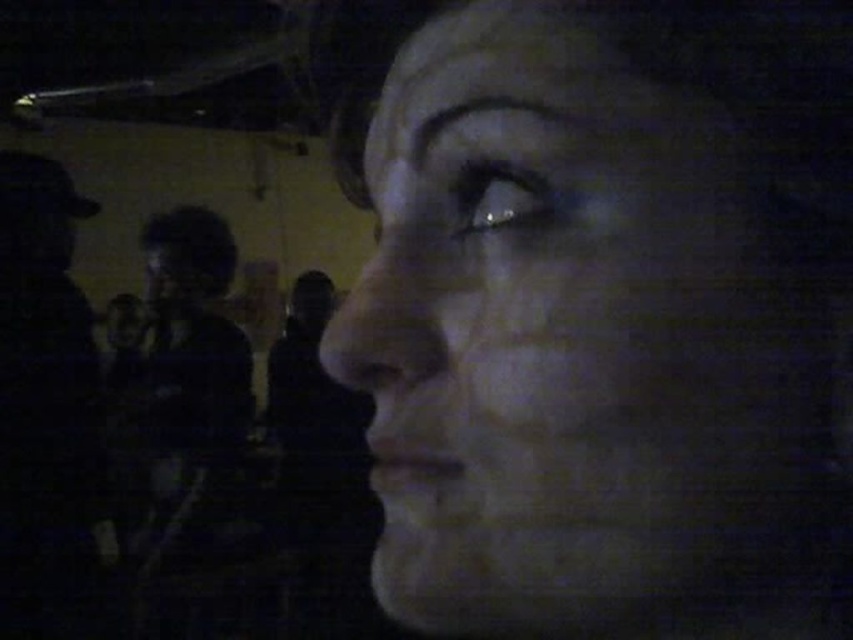
You are holding a camera and want to focus on a specific point in the image. The point you want to focus on is located at coordinates point (595, 582). Given that the distance from the camera to this point is 9.54 inches, can you confirm if this point is within the typical focusing range of a standard camera lens?

The distance of point (595, 582) from the camera is 9.54 inches. Standard camera lenses typically have a minimum focusing distance of around 8 inches, so this point is within the typical focusing range.

You are a photographer trying to position a spotlight for a photo shoot. You need to place the spotlight so that it illuminates the dark matte jacket at left without affecting the rest of the scene. Given the jacket is located at coordinates point 0.641, 0.054, where should you aim the spotlight?

The dark matte jacket at left is located at point (45, 410), so you should aim the spotlight at those coordinates to illuminate it without affecting the rest of the scene.